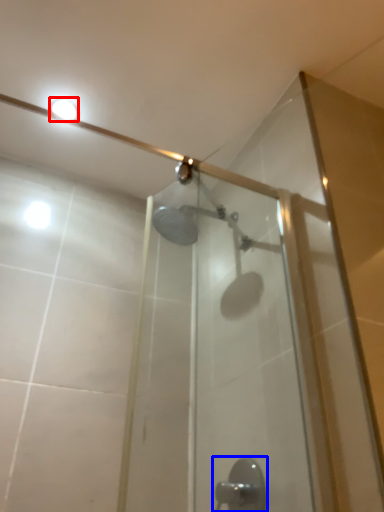
Question: Which object is closer to the camera taking this photo, light fixture (highlighted by a red box) or door handle (highlighted by a blue box)?

Choices:
 (A) light fixture
 (B) door handle

Answer: (B)